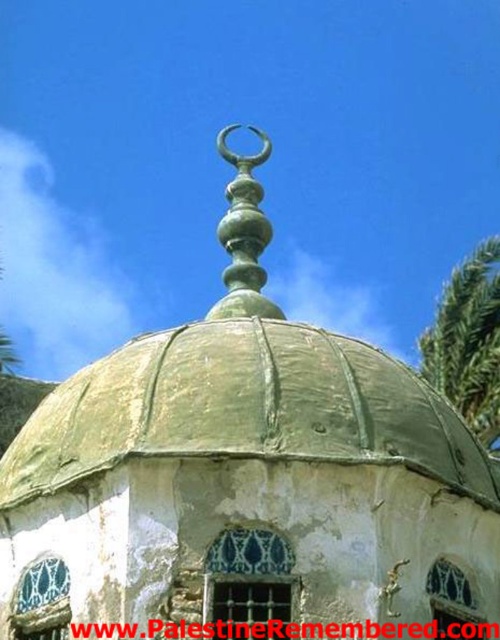
Question: Which point is farther to the camera?

Choices:
 (A) (261, 224)
 (B) (476, 257)

Answer: (B)

Question: Is green leafy palm tree at right to the left of green polished metal spire at center from the viewer's perspective?

Choices:
 (A) no
 (B) yes

Answer: (A)

Question: Does green leafy palm tree at right lie in front of green polished metal spire at center?

Choices:
 (A) no
 (B) yes

Answer: (A)

Question: Which point is closer to the camera?

Choices:
 (A) (250, 236)
 (B) (478, 392)

Answer: (A)

Question: Is green leafy palm tree at right closer to camera compared to green polished metal spire at center?

Choices:
 (A) no
 (B) yes

Answer: (A)